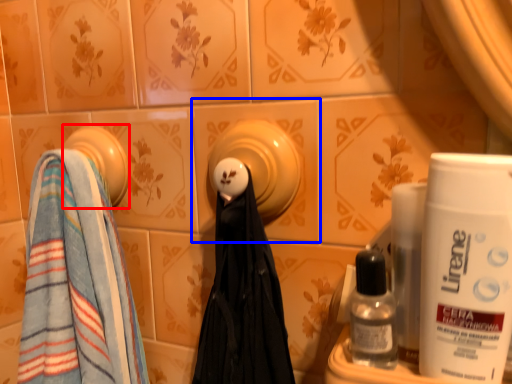
Question: Which of the following is the closest to the observer, towel (highlighted by a red box) or ceramic tile (highlighted by a blue box)?

Choices:
 (A) towel
 (B) ceramic tile

Answer: (B)